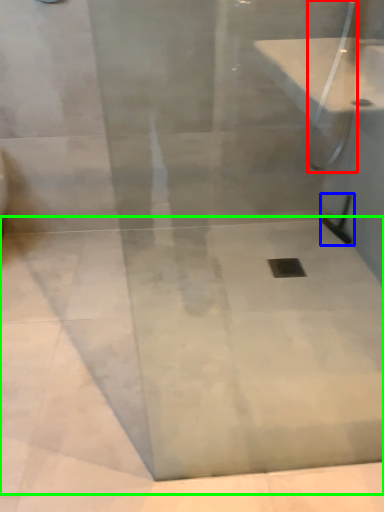
Question: Which object is positioned closest to shower (highlighted by a red box)? Select from shower (highlighted by a blue box) and concrete (highlighted by a green box).

Choices:
 (A) shower
 (B) concrete

Answer: (A)